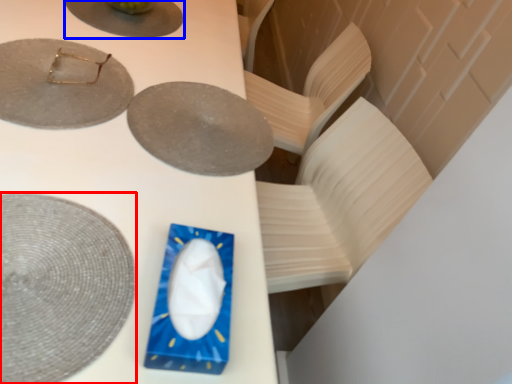
Question: Which object appears farthest to the camera in this image, plate (highlighted by a red box) or plate (highlighted by a blue box)?

Choices:
 (A) plate
 (B) plate

Answer: (B)